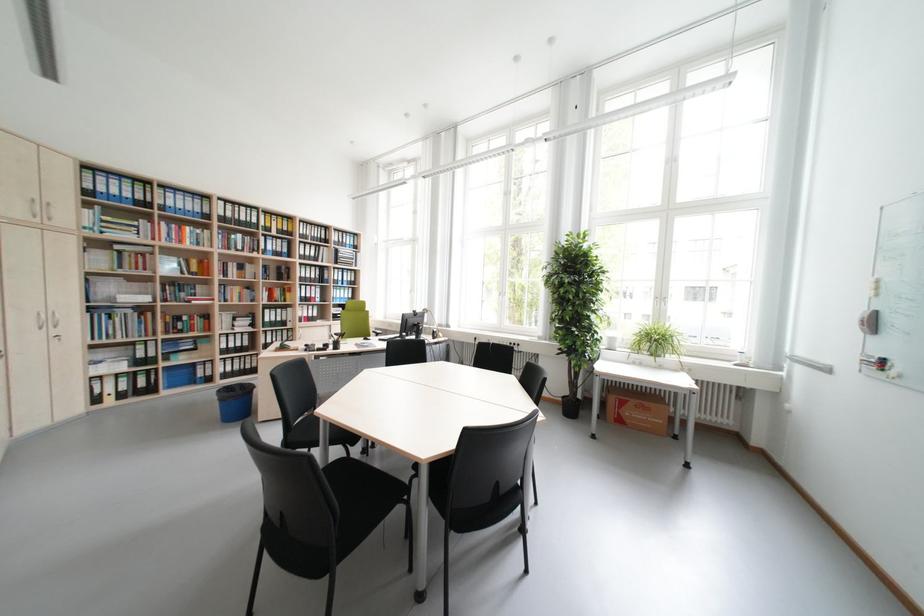
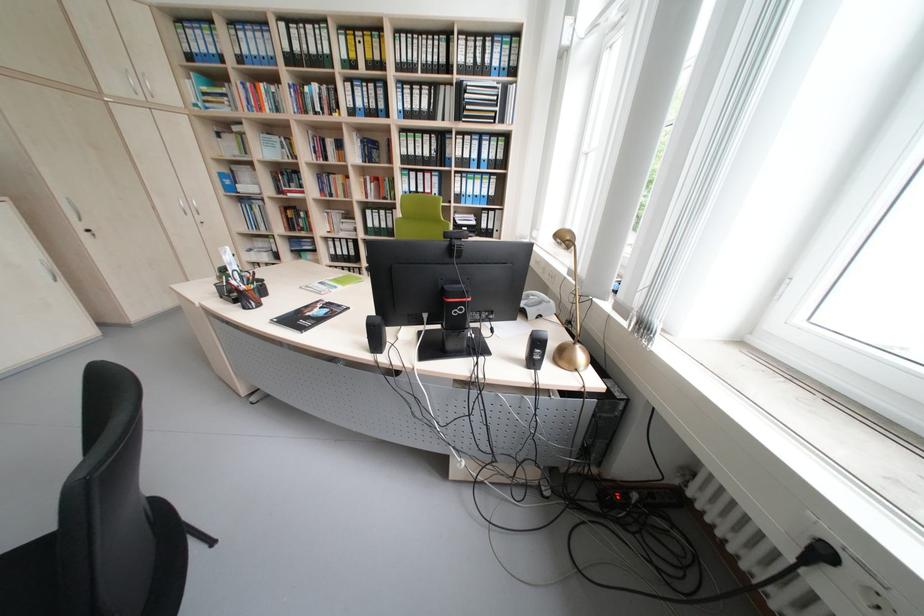
In the second image, find the point that corresponds to point (346, 264) in the first image.

(468, 119)